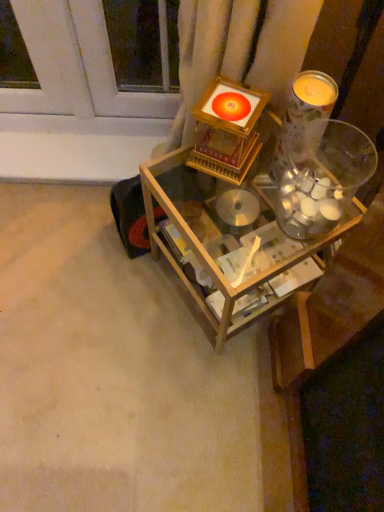
You are a GUI agent. You are given a task and a screenshot of the screen. Output one action in this format:
    pyautogui.click(x=<x>, y=<y>)
    Task: Click on the free space to the left of clear glass jar at upper right
    The height and width of the screenshot is (512, 384).
    Given the screenshot: What is the action you would take?
    pyautogui.click(x=226, y=236)